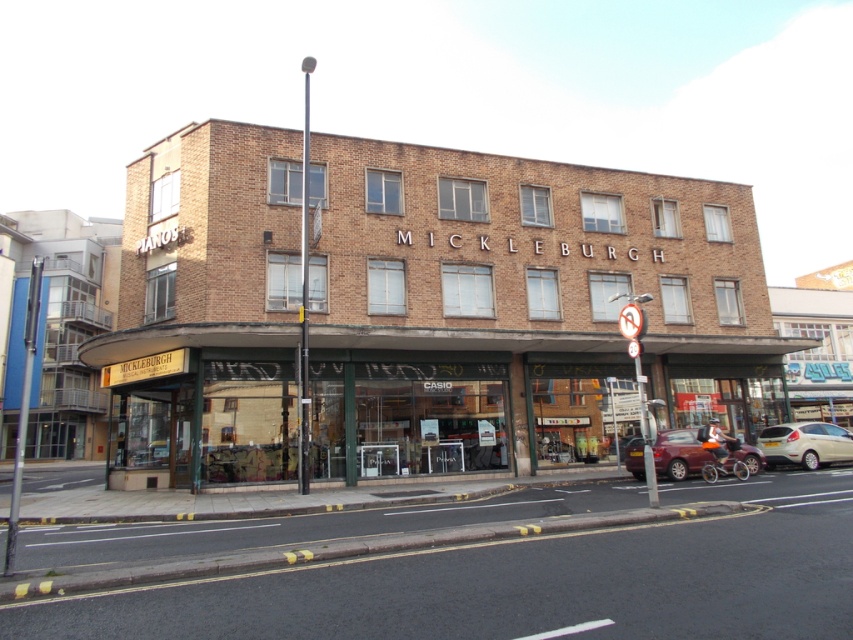
You are a delivery person trying to park your van in front of the brown brick building at center. The van requires a parking space that is at least as wide as the metallic circular sign at right. Can you park your van here based on the building and sign dimensions?

The brown brick building at center is wider than the metallic circular sign at right, so the parking space in front of the building should be wide enough to accommodate the van.

Looking at this image, you are a delivery driver who needs to park your vehicle in the parking spot next to the matte red car at lower right. However, the parking spot is only 4 meters long. Can your white matte car at lower right, which is 4.5 meters long, fit into the space?

The white matte car at lower right is larger than the matte red car at lower right. Since the parking spot is only 4 meters long and the white matte car at lower right is 4.5 meters long, it cannot fit into the space.